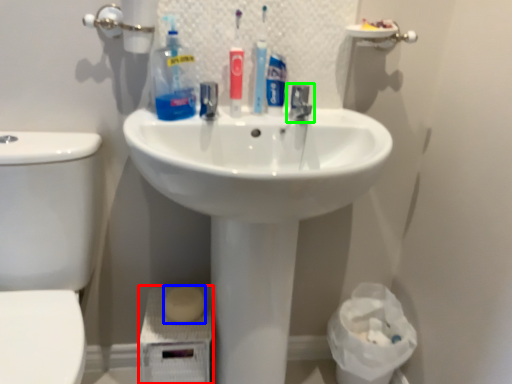
Question: Considering the real-world distances, which object is farthest from porcelain (highlighted by a red box)? soap (highlighted by a blue box) or tap (highlighted by a green box)?

Choices:
 (A) soap
 (B) tap

Answer: (B)